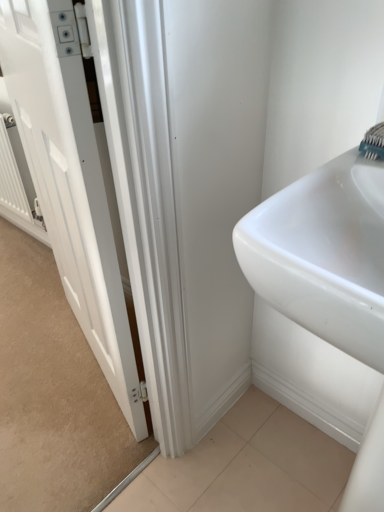
Question: From a real-world perspective, relative to white metallic radiator at left, is white glossy door at left vertically above or below?

Choices:
 (A) above
 (B) below

Answer: (A)

Question: Considering the positions of white glossy door at left and white metallic radiator at left in the image, is white glossy door at left taller or shorter than white metallic radiator at left?

Choices:
 (A) short
 (B) tall

Answer: (B)

Question: Which is nearer to the white metallic radiator at left?

Choices:
 (A) teal plastic toothbrush at upper right
 (B) white glossy door at left

Answer: (B)

Question: Which of these objects is positioned closest to the white metallic radiator at left?

Choices:
 (A) teal plastic toothbrush at upper right
 (B) white glossy door at left

Answer: (B)